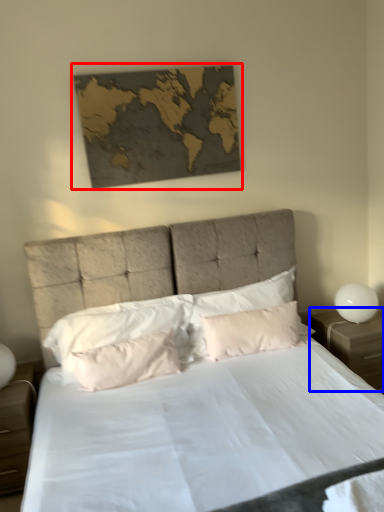
Question: Which object is further to the camera taking this photo, picture frame (highlighted by a red box) or nightstand (highlighted by a blue box)?

Choices:
 (A) picture frame
 (B) nightstand

Answer: (B)